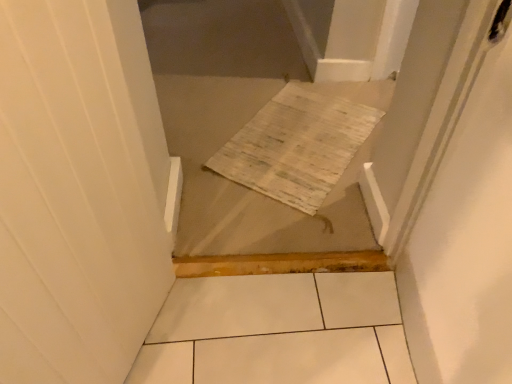
Question: From the image's perspective, is woven fabric rug at center over white glossy screen door at upper right?

Choices:
 (A) no
 (B) yes

Answer: (A)

Question: From a real-world perspective, is woven fabric rug at center over white glossy screen door at upper right?

Choices:
 (A) no
 (B) yes

Answer: (A)

Question: Considering the relative sizes of woven fabric rug at center and white glossy screen door at upper right in the image provided, is woven fabric rug at center smaller than white glossy screen door at upper right?

Choices:
 (A) yes
 (B) no

Answer: (A)

Question: Is white glossy screen door at upper right a part of woven fabric rug at center?

Choices:
 (A) no
 (B) yes

Answer: (A)

Question: Is woven fabric rug at center with white glossy screen door at upper right?

Choices:
 (A) no
 (B) yes

Answer: (A)

Question: From the image's perspective, would you say woven fabric rug at center is shown under white glossy screen door at upper right?

Choices:
 (A) yes
 (B) no

Answer: (A)

Question: Is white glossy screen door at upper right far away from woven fabric rug at center?

Choices:
 (A) yes
 (B) no

Answer: (B)

Question: From the image's perspective, does white glossy screen door at upper right appear lower than woven fabric rug at center?

Choices:
 (A) yes
 (B) no

Answer: (B)

Question: Is white glossy screen door at upper right facing towards woven fabric rug at center?

Choices:
 (A) yes
 (B) no

Answer: (A)

Question: Is white glossy screen door at upper right smaller than woven fabric rug at center?

Choices:
 (A) yes
 (B) no

Answer: (B)

Question: Considering the relative sizes of white glossy screen door at upper right and woven fabric rug at center in the image provided, is white glossy screen door at upper right bigger than woven fabric rug at center?

Choices:
 (A) yes
 (B) no

Answer: (A)

Question: Considering the relative sizes of white glossy screen door at upper right and woven fabric rug at center in the image provided, is white glossy screen door at upper right wider than woven fabric rug at center?

Choices:
 (A) yes
 (B) no

Answer: (B)

Question: Looking at their shapes, would you say woven fabric rug at center is wider or thinner than white glossy screen door at upper right?

Choices:
 (A) wide
 (B) thin

Answer: (A)